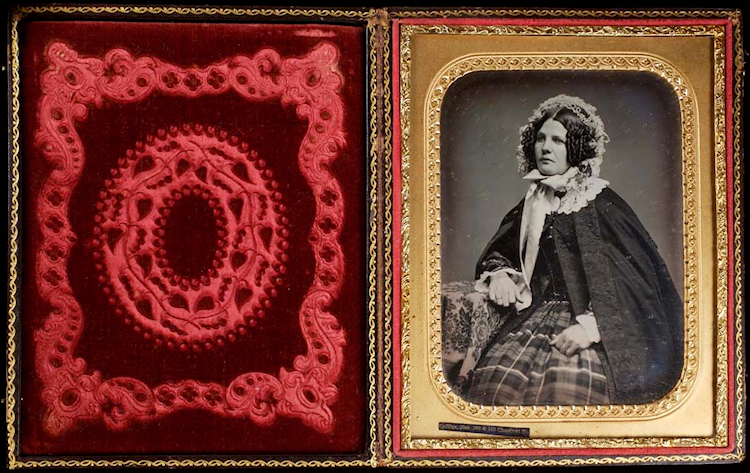
This screenshot has width=750, height=473. I want to click on chair, so click(x=464, y=324).